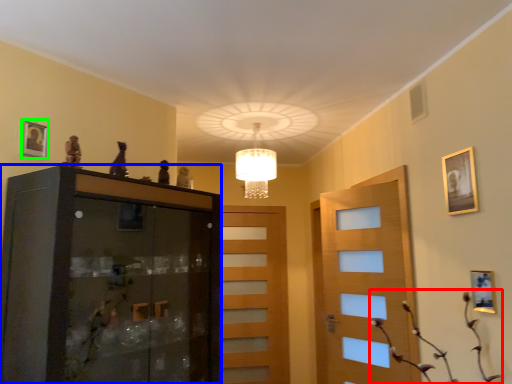
Question: Which object is the farthest from plant (highlighted by a red box)? Choose among these: cabinetry (highlighted by a blue box) or picture frame (highlighted by a green box).

Choices:
 (A) cabinetry
 (B) picture frame

Answer: (B)